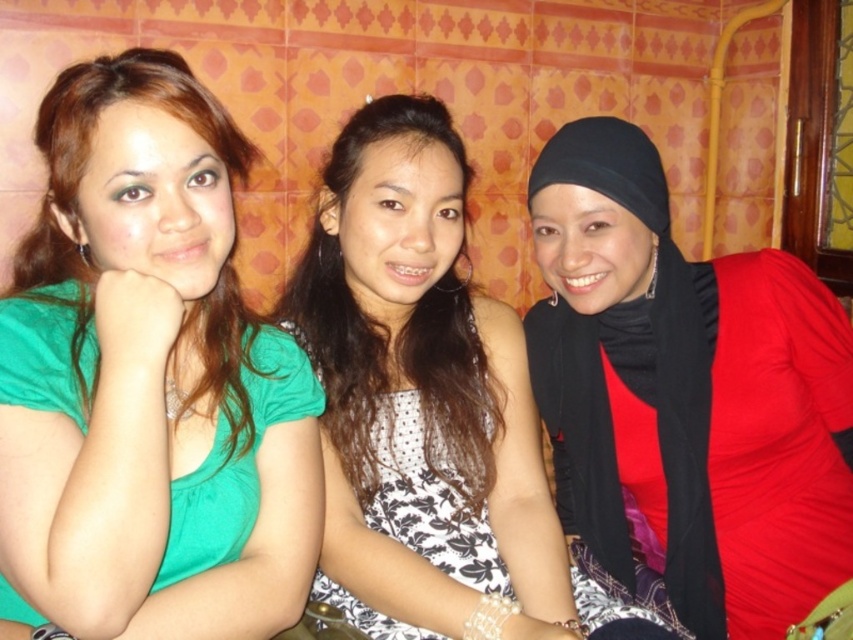
Which is behind, point (271, 481) or point (386, 508)?

The point (386, 508) is more distant.

Is point (141, 49) closer to camera compared to point (451, 172)?

Yes, point (141, 49) is closer to viewer.

Is point (93, 228) closer to viewer compared to point (334, 196)?

Yes, point (93, 228) is closer to viewer.

This screenshot has width=853, height=640. I want to click on green matte shirt at left, so click(x=148, y=381).

How distant is black matte hijab at right from polka dot fabric dress at center?

12.10 inches

Locate an element on the screen. This screenshot has height=640, width=853. black matte hijab at right is located at coordinates (688, 394).

Based on the photo, is black matte hijab at right further to camera compared to white dotted dress at center?

Yes.

Between point (761, 452) and point (447, 394), which one is positioned in front?

Point (447, 394) is in front.

The height and width of the screenshot is (640, 853). Find the location of `black matte hijab at right`. black matte hijab at right is located at coordinates (688, 394).